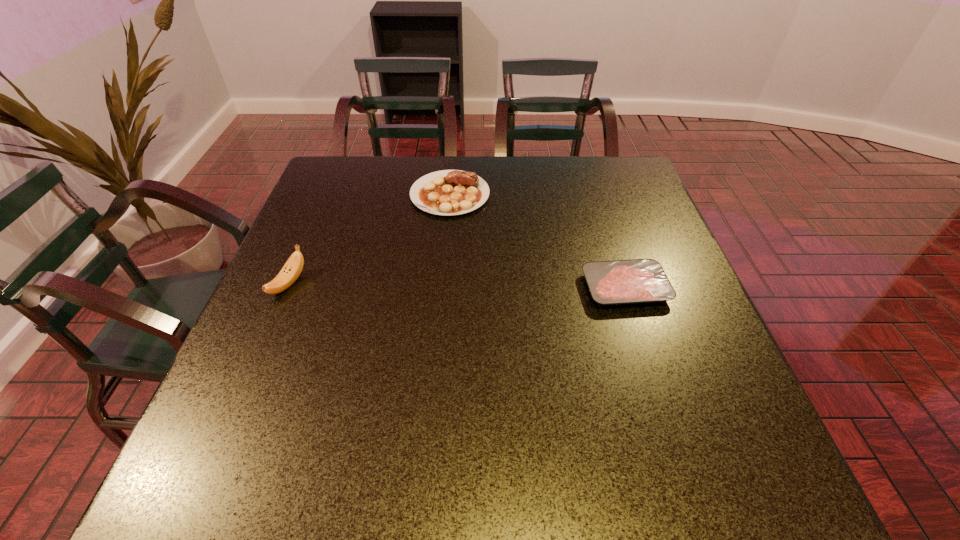
Point out which object is positioned as the second nearest to the second shortest object. Please provide its 2D coordinates. Your answer should be formatted as a tuple, i.e. [(x, y)], where the tuple contains the x and y coordinates of a point satisfying the conditions above.

[(290, 272)]

I want to click on free space in the image that satisfies the following two spatial constraints: 1. on the front side of the rightmost object; 2. on the right side of the second tallest object, so click(x=443, y=288).

The width and height of the screenshot is (960, 540). In order to click on free location that satisfies the following two spatial constraints: 1. on the front side of the second object from right to left; 2. on the left side of the rightmost object in this screenshot , I will do `click(443, 288)`.

This screenshot has width=960, height=540. Find the location of `free region that satisfies the following two spatial constraints: 1. on the front side of the tallest object; 2. on the right side of the right steak`. free region that satisfies the following two spatial constraints: 1. on the front side of the tallest object; 2. on the right side of the right steak is located at coordinates (287, 288).